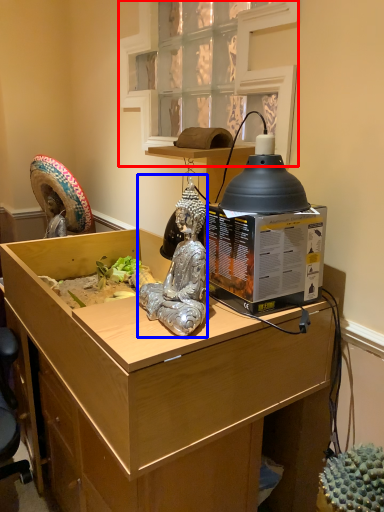
Question: Which point is closer to the camera, window (highlighted by a red box) or person (highlighted by a blue box)?

Choices:
 (A) window
 (B) person

Answer: (B)